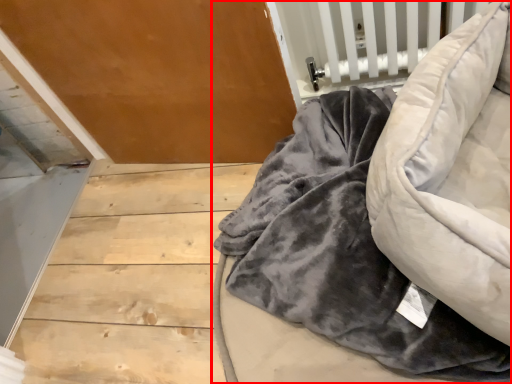
Question: From the image's perspective, where is furniture (annotated by the red box) located relative to bean bag chair?

Choices:
 (A) below
 (B) above

Answer: (A)